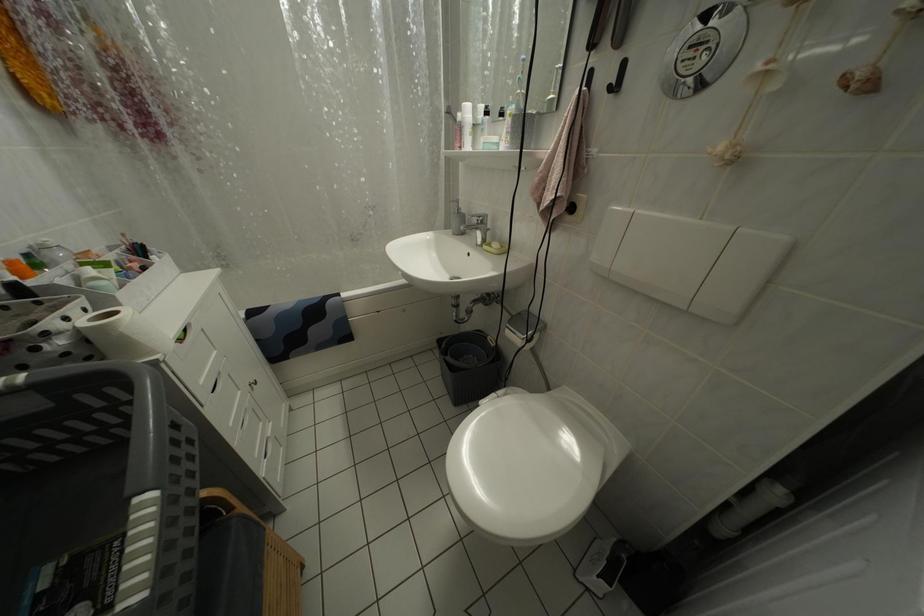
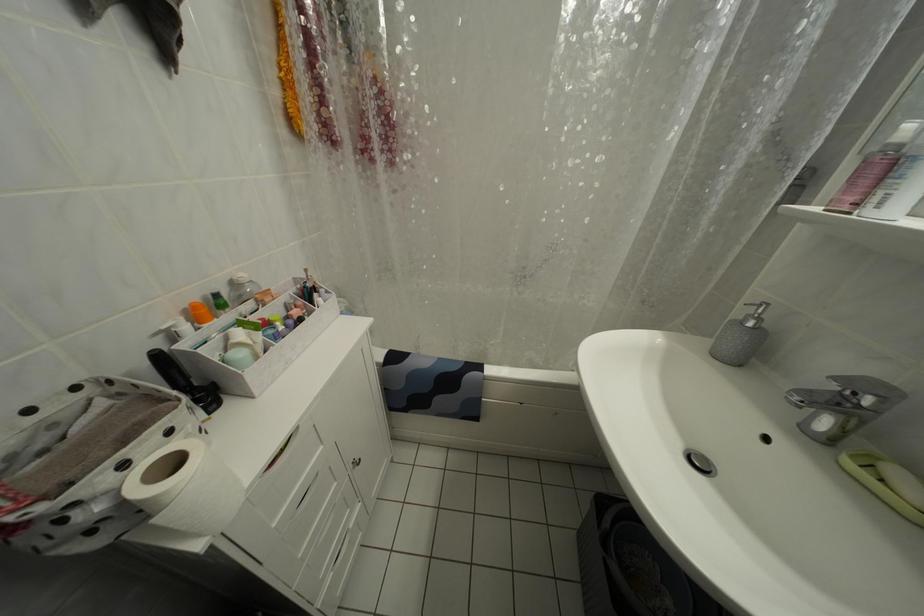
Question: The first image is from the beginning of the video and the second image is from the end. How did the camera likely rotate when shooting the video?

Choices:
 (A) Left
 (B) Right
 (C) Up
 (D) Down

Answer: (A)